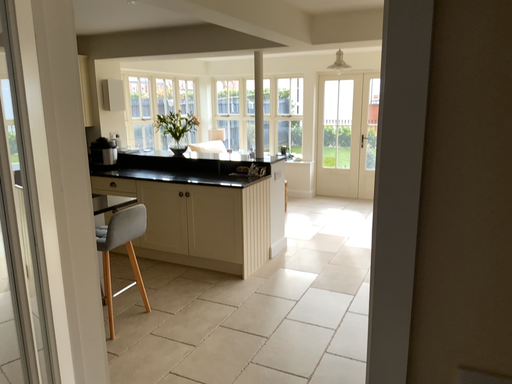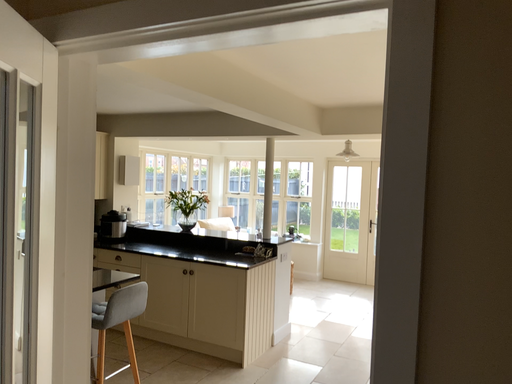
Question: How did the camera likely rotate when shooting the video?

Choices:
 (A) rotated upward
 (B) rotated downward

Answer: (A)